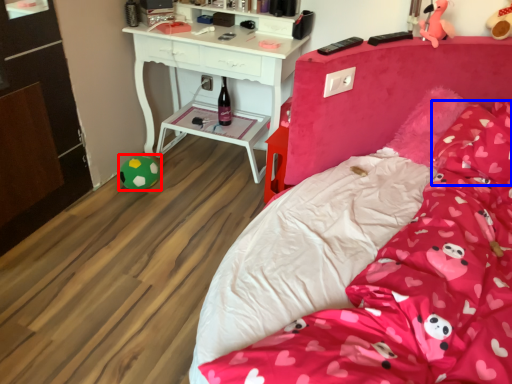
Question: Among these objects, which one is farthest to the camera, toy (highlighted by a red box) or pillow (highlighted by a blue box)?

Choices:
 (A) toy
 (B) pillow

Answer: (A)